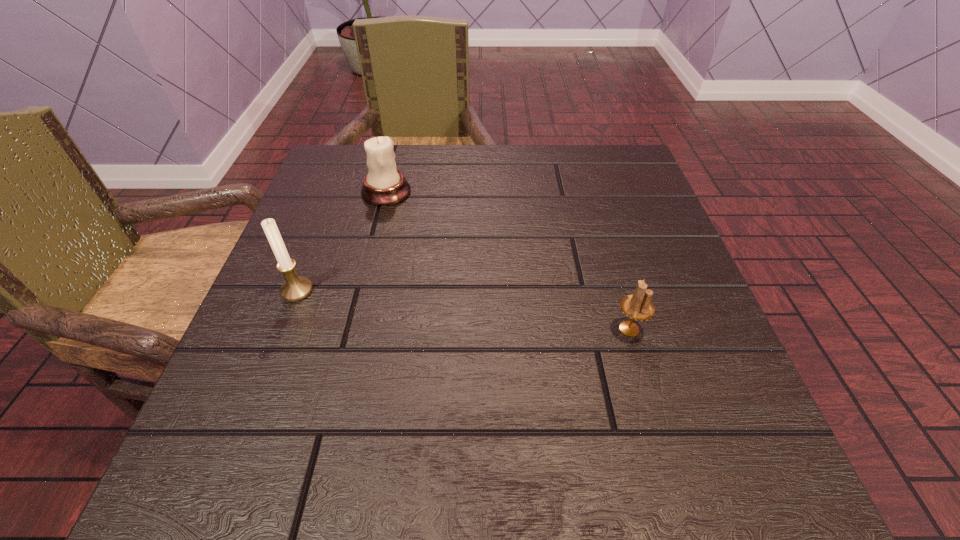
Locate an element on the screen. object situated at the right edge is located at coordinates (638, 306).

The height and width of the screenshot is (540, 960). I want to click on object that is at the far left corner, so click(384, 185).

You are a GUI agent. You are given a task and a screenshot of the screen. Output one action in this format:
    pyautogui.click(x=<x>, y=<y>)
    Task: Click on the free region at the far edge
    The height and width of the screenshot is (540, 960).
    Given the screenshot: What is the action you would take?
    pyautogui.click(x=404, y=175)

The image size is (960, 540). I want to click on vacant space at the left edge of the desktop, so click(x=281, y=334).

In the image, there is a desktop. Where is `free space at the right edge`? The height and width of the screenshot is (540, 960). free space at the right edge is located at coordinates point(715,354).

This screenshot has width=960, height=540. What are the coordinates of `vacant space at the far left corner of the desktop` in the screenshot? It's located at (339, 164).

I want to click on vacant space at the far right corner of the desktop, so click(631, 188).

At what (x,y) coordinates should I click in order to perform the action: click on free space at the near right corner of the desktop. Please return your answer as a coordinate pair (x, y). Looking at the image, I should click on (667, 492).

I want to click on vacant space that's between the leftmost object and the nearest candle holder, so click(x=463, y=310).

Identify the location of vacant space that is in between the leftmost candle holder and the farthest candle holder. click(342, 241).